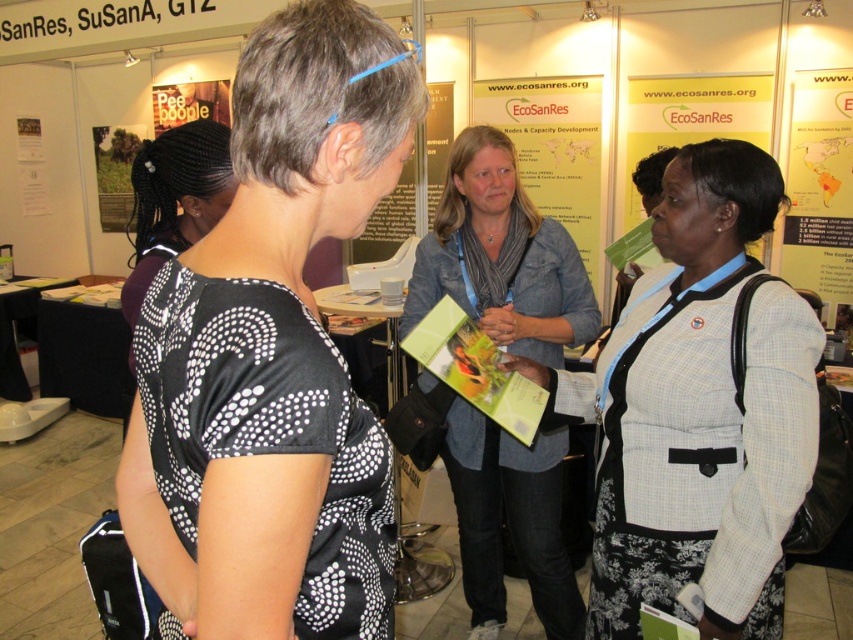
Question: Considering the relative positions of black dotted fabric shirt at center and denim jacket at center in the image provided, where is black dotted fabric shirt at center located with respect to denim jacket at center?

Choices:
 (A) above
 (B) below

Answer: (A)

Question: Does white textured blazer at center appear under denim jacket at center?

Choices:
 (A) no
 (B) yes

Answer: (A)

Question: Among these points, which one is farthest from the camera?

Choices:
 (A) (477, 292)
 (B) (750, 440)
 (C) (677, 140)
 (D) (376, 616)

Answer: (C)

Question: Does black dotted fabric shirt at center have a larger size compared to denim jacket at center?

Choices:
 (A) yes
 (B) no

Answer: (B)

Question: Which object appears farthest from the camera in this image?

Choices:
 (A) denim jacket at center
 (B) matte green paper at center

Answer: (B)

Question: Which of the following is the farthest from the observer?

Choices:
 (A) matte green paper at center
 (B) white textured blazer at center

Answer: (A)